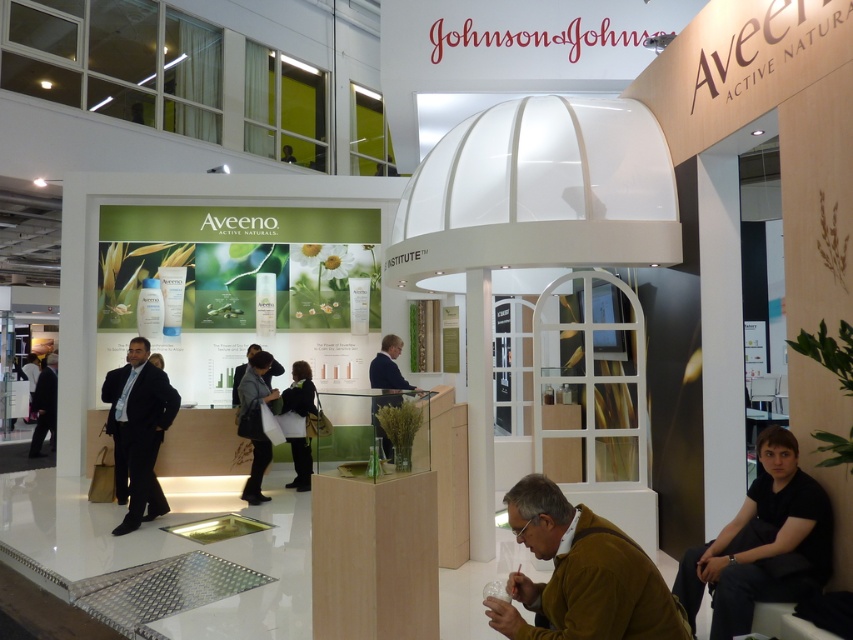
Question: Does dark gray fabric jacket at center appear over dark blue fabric at center?

Choices:
 (A) no
 (B) yes

Answer: (A)

Question: Which point is farther to the camera?

Choices:
 (A) (467, 397)
 (B) (567, 595)

Answer: (A)

Question: Does dark suit at center have a larger size compared to dark gray fabric jacket at center?

Choices:
 (A) no
 (B) yes

Answer: (B)

Question: Among these objects, which one is farthest from the camera?

Choices:
 (A) dark gray fabric jacket at center
 (B) dark blue fabric at center
 (C) dark suit at center

Answer: (B)

Question: Can you confirm if dark suit at center is wider than white wood pillar at center?

Choices:
 (A) no
 (B) yes

Answer: (B)

Question: Which point appears farthest from the camera in this image?

Choices:
 (A) (299, 433)
 (B) (555, 616)
 (C) (155, 408)

Answer: (A)